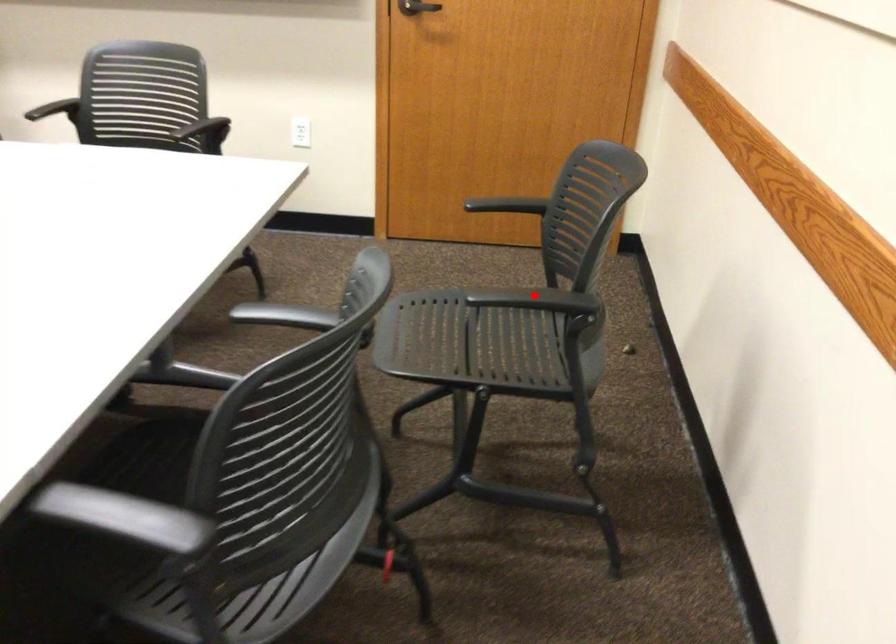
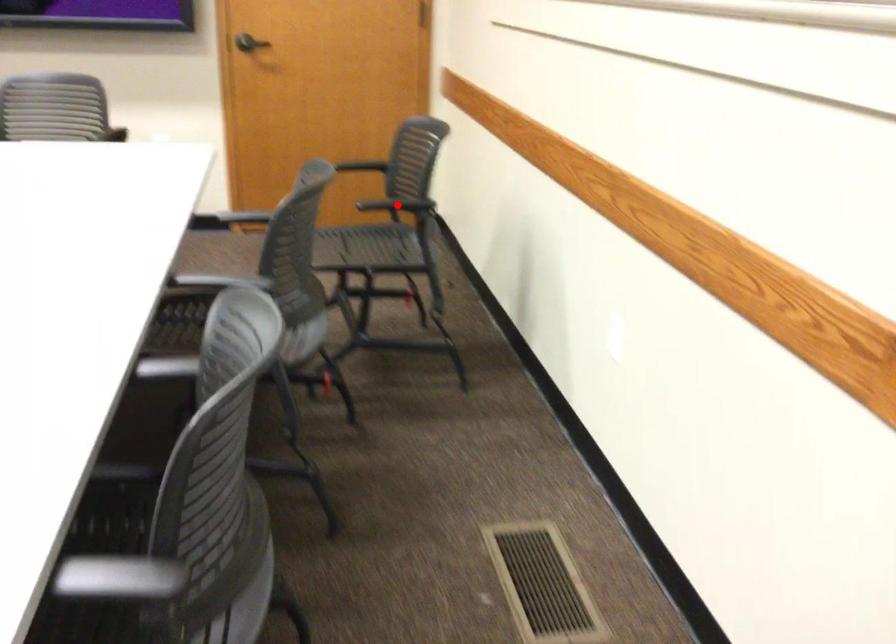
I am providing you with two images of the same scene from different viewpoints. A red point is marked on the first image and another point is marked on the second image. Does the point marked in image1 correspond to the same location as the one in image2?

Yes